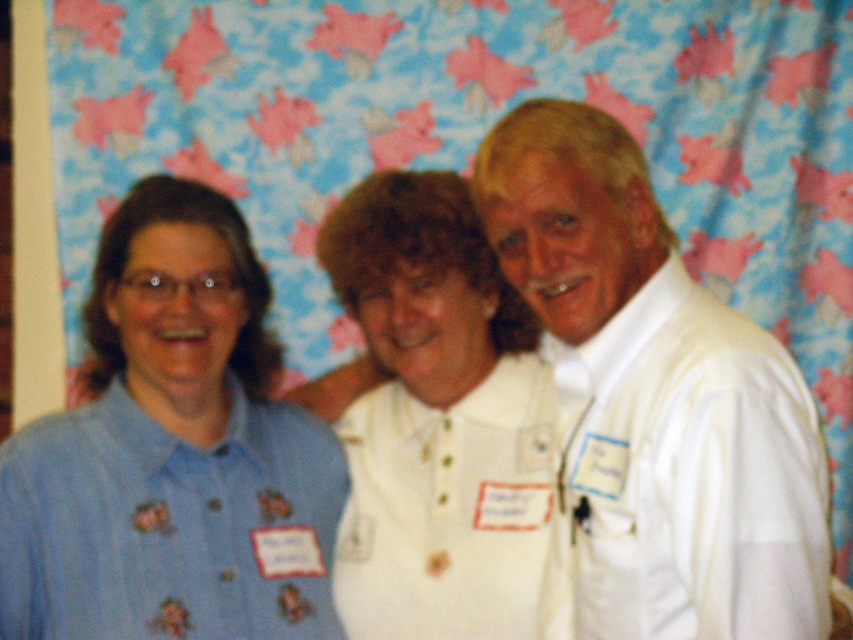
You are taking a photo of the three people in the scene. You want to focus on the person closest to you. Which point should you focus on, point (x=0, y=522) or point (x=671, y=470)?

Point (x=0, y=522) is further to the camera than point (x=671, y=470), so you should focus on point (x=0, y=522) to capture the person closest to you.

You are a photographer setting up for a group photo. You notice the white satin shirt at right is partially hidden by the white cotton shirt at center. Which shirt should you adjust to ensure both are fully visible in the photo?

You should adjust the white cotton shirt at center, as the white satin shirt at right is behind it and needs to be more visible.

You are trying to determine the position of the blue cotton shirt at left and the white cotton shirt at center in the image. Based on their positions, which one is closer to the bottom of the image?

The blue cotton shirt at left is below the white cotton shirt at center, so the blue cotton shirt at left is closer to the bottom of the image.